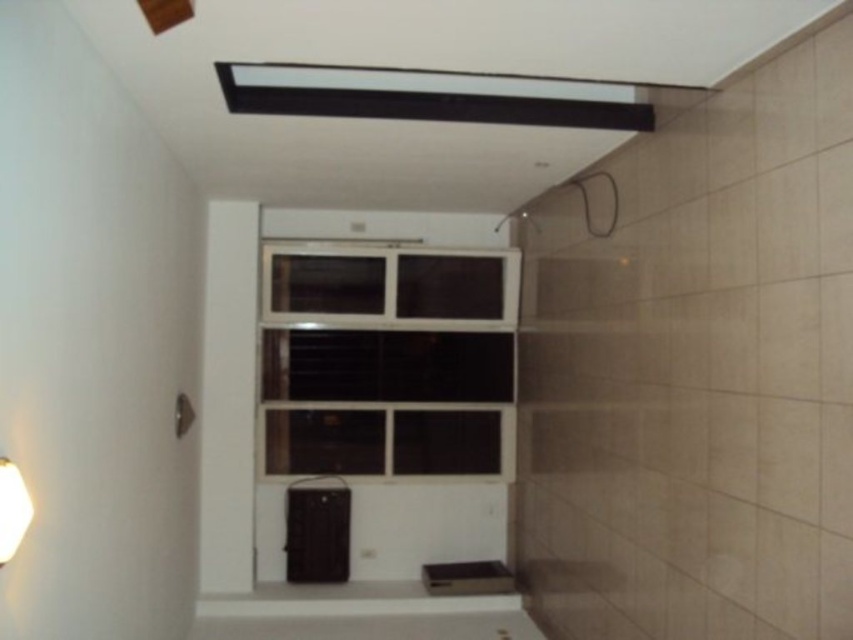
Consider the image. You are standing in the room and want to locate the clear glass window at center and the white matte lampshade at lower left. Based on their positions, which object is closer to the right wall?

The clear glass window at center is closer to the right wall because it is positioned to the right of the white matte lampshade at lower left.

Based on the photo, you are an interior designer assessing the space. You need to place a new rectangular shelf that is 1.2 meters wide. The shelf must be placed either next to the clear glass window at center or above the white matte lampshade at lower left. Based on their widths, which location would allow the shelf to fit without exceeding the space?

The clear glass window at center has a larger width than the white matte lampshade at lower left. Since the shelf is 1.2 meters wide, it would fit better next to the clear glass window at center where there is more space.